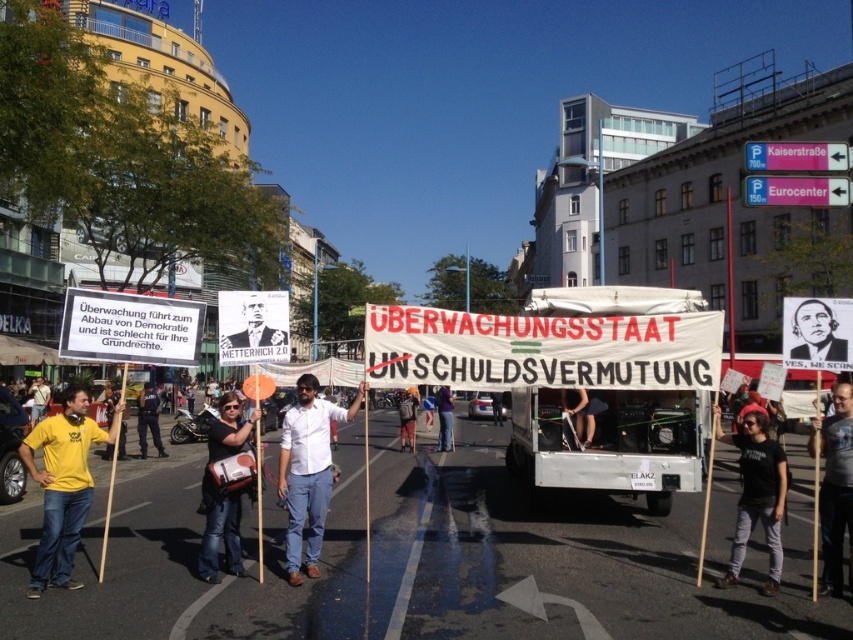
Between smooth black portrait at center and dark blue uniform at center, which one is positioned lower?

Positioned lower is dark blue uniform at center.

Measure the distance between smooth black portrait at center and dark blue uniform at center.

The distance of smooth black portrait at center from dark blue uniform at center is 52.86 feet.

Describe the element at coordinates (816, 332) in the screenshot. I see `smooth black portrait at center` at that location.

Image resolution: width=853 pixels, height=640 pixels. Find the location of `smooth black portrait at center`. smooth black portrait at center is located at coordinates (816, 332).

Which of these two, black matte t-shirt at lower right or dark blue jeans at center, stands shorter?

dark blue jeans at center

Is the position of black matte t-shirt at lower right less distant than that of dark blue jeans at center?

Yes, it is in front of dark blue jeans at center.

Is point (776, 548) farther from viewer compared to point (563, 410)?

No, it is in front of (563, 410).

In order to click on black matte t-shirt at lower right in this screenshot , I will do `click(757, 497)`.

Can you confirm if gray cotton shirt at center is positioned to the right of dark blue uniform at center?

Correct, you'll find gray cotton shirt at center to the right of dark blue uniform at center.

Which is below, gray cotton shirt at center or dark blue uniform at center?

dark blue uniform at center is below.

Looking at this image, measure the distance between gray cotton shirt at center and camera.

6.14 meters

Where is `gray cotton shirt at center`? gray cotton shirt at center is located at coordinates [x=834, y=483].